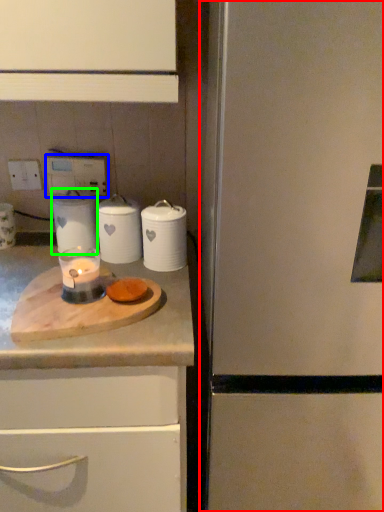
Question: Based on their relative distances, which object is nearer to refrigerator (highlighted by a red box)? Choose from electric outlet (highlighted by a blue box) and kitchen appliance (highlighted by a green box).

Choices:
 (A) electric outlet
 (B) kitchen appliance

Answer: (B)